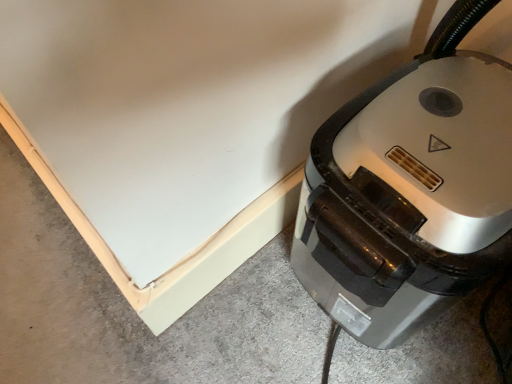
Question: Is gray concrete at lower left looking in the opposite direction of metallic gray vacuum cleaner at lower right?

Choices:
 (A) yes
 (B) no

Answer: (B)

Question: From a real-world perspective, is gray concrete at lower left physically above metallic gray vacuum cleaner at lower right?

Choices:
 (A) yes
 (B) no

Answer: (B)

Question: Is gray concrete at lower left wider than metallic gray vacuum cleaner at lower right?

Choices:
 (A) yes
 (B) no

Answer: (A)

Question: Are gray concrete at lower left and metallic gray vacuum cleaner at lower right located far from each other?

Choices:
 (A) no
 (B) yes

Answer: (A)

Question: Is gray concrete at lower left facing towards metallic gray vacuum cleaner at lower right?

Choices:
 (A) yes
 (B) no

Answer: (B)

Question: Is gray concrete at lower left outside metallic gray vacuum cleaner at lower right?

Choices:
 (A) no
 (B) yes

Answer: (B)

Question: Can you confirm if metallic gray vacuum cleaner at lower right is positioned to the right of gray concrete at lower left?

Choices:
 (A) yes
 (B) no

Answer: (A)

Question: Considering the relative positions of metallic gray vacuum cleaner at lower right and gray concrete at lower left in the image provided, is metallic gray vacuum cleaner at lower right in front of gray concrete at lower left?

Choices:
 (A) no
 (B) yes

Answer: (B)

Question: Considering the relative sizes of metallic gray vacuum cleaner at lower right and gray concrete at lower left in the image provided, is metallic gray vacuum cleaner at lower right thinner than gray concrete at lower left?

Choices:
 (A) yes
 (B) no

Answer: (A)

Question: From a real-world perspective, is metallic gray vacuum cleaner at lower right on gray concrete at lower left?

Choices:
 (A) no
 (B) yes

Answer: (B)

Question: Is metallic gray vacuum cleaner at lower right positioned behind gray concrete at lower left?

Choices:
 (A) yes
 (B) no

Answer: (B)

Question: Is metallic gray vacuum cleaner at lower right outside of gray concrete at lower left?

Choices:
 (A) yes
 (B) no

Answer: (A)

Question: Does point (365, 140) appear closer or farther from the camera than point (38, 251)?

Choices:
 (A) farther
 (B) closer

Answer: (B)